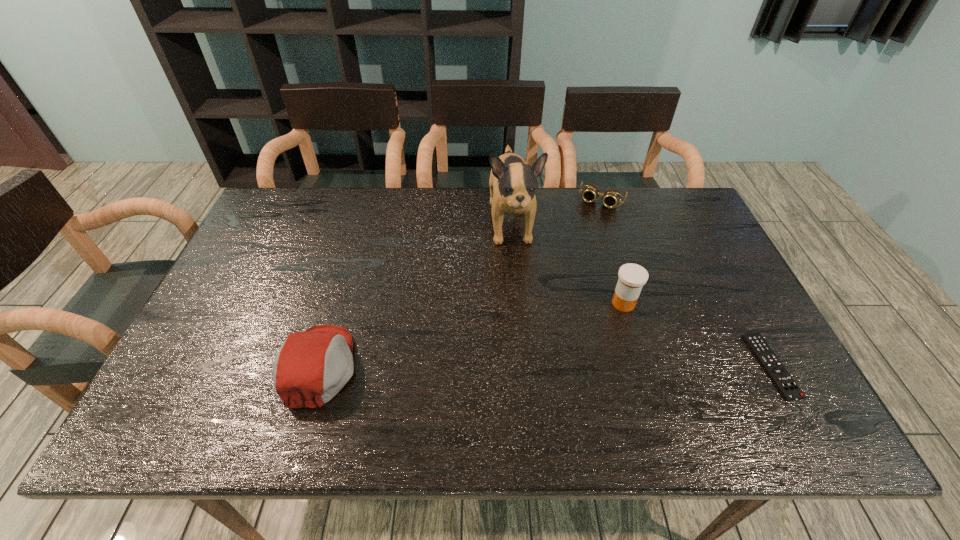
What are the coordinates of `vacant space located on the label of the third farthest object` in the screenshot? It's located at pyautogui.click(x=551, y=350).

Locate an element on the screen. vacant space situated on the label of the third farthest object is located at coordinates (598, 320).

Where is `vacant area situated 0.220m at the face of the puppy`? The height and width of the screenshot is (540, 960). vacant area situated 0.220m at the face of the puppy is located at coordinates (524, 320).

Image resolution: width=960 pixels, height=540 pixels. What are the coordinates of `free space located at the face of the puppy` in the screenshot? It's located at (534, 383).

What are the coordinates of `vacant space situated at the face of the puppy` in the screenshot? It's located at (523, 312).

At what (x,y) coordinates should I click in order to perform the action: click on vacant point located through the lenses of the second shortest object. Please return your answer as a coordinate pair (x, y). Looking at the image, I should click on (585, 234).

The height and width of the screenshot is (540, 960). In order to click on vacant position located 0.220m through the lenses of the second shortest object in this screenshot , I will do `click(576, 252)`.

The width and height of the screenshot is (960, 540). I want to click on free region located 0.220m through the lenses of the second shortest object, so click(576, 252).

Identify the location of puppy present at the far edge. (512, 182).

Image resolution: width=960 pixels, height=540 pixels. In order to click on goggles positioned at the far edge in this screenshot , I will do `click(611, 197)`.